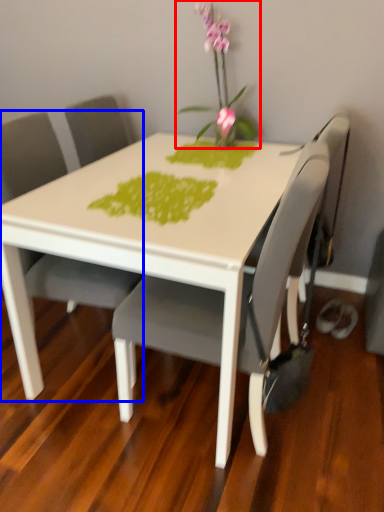
Question: Which object appears closest to the camera in this image, houseplant (highlighted by a red box) or chair (highlighted by a blue box)?

Choices:
 (A) houseplant
 (B) chair

Answer: (B)